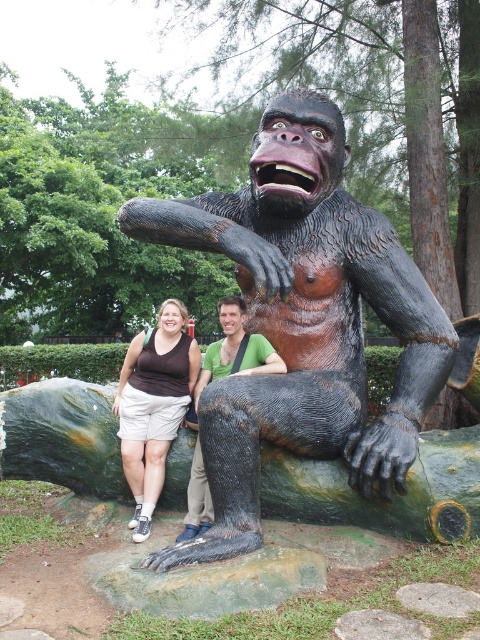
Question: Is brown cotton shorts at lower left positioned before green matte shirt at center?

Choices:
 (A) yes
 (B) no

Answer: (A)

Question: Among these points, which one is farthest from the camera?

Choices:
 (A) coord(139,435)
 (B) coord(273,392)

Answer: (A)

Question: Among these objects, which one is nearest to the camera?

Choices:
 (A) green matte shirt at center
 (B) brown cotton shorts at lower left

Answer: (B)

Question: Is shiny bronze statue at center below brown cotton shorts at lower left?

Choices:
 (A) no
 (B) yes

Answer: (A)

Question: Can you confirm if shiny bronze statue at center is positioned below brown cotton shorts at lower left?

Choices:
 (A) yes
 (B) no

Answer: (B)

Question: Which object appears farthest from the camera in this image?

Choices:
 (A) brown cotton shorts at lower left
 (B) green matte shirt at center

Answer: (B)